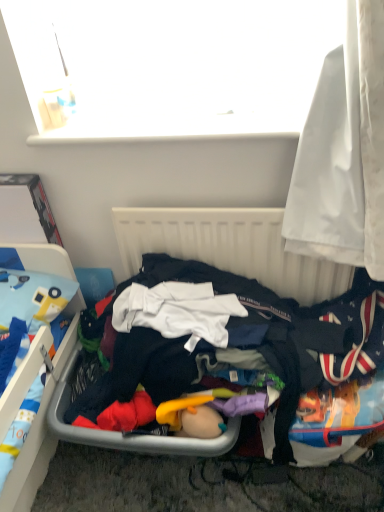
Question: Does white fabric curtain at right turn towards white plastic radiator at center?

Choices:
 (A) no
 (B) yes

Answer: (A)

Question: From a real-world perspective, does white fabric curtain at right stand above white plastic radiator at center?

Choices:
 (A) yes
 (B) no

Answer: (A)

Question: Can you confirm if white fabric curtain at right is thinner than white plastic radiator at center?

Choices:
 (A) yes
 (B) no

Answer: (B)

Question: Is white fabric curtain at right positioned far away from white plastic radiator at center?

Choices:
 (A) no
 (B) yes

Answer: (A)

Question: Does white fabric curtain at right have a lesser height compared to white plastic radiator at center?

Choices:
 (A) no
 (B) yes

Answer: (A)

Question: Is white fabric curtain at right taller than white plastic radiator at center?

Choices:
 (A) yes
 (B) no

Answer: (A)

Question: From a real-world perspective, is white plastic radiator at center physically below white fabric curtain at right?

Choices:
 (A) no
 (B) yes

Answer: (B)

Question: Can you confirm if white plastic radiator at center is taller than white fabric curtain at right?

Choices:
 (A) no
 (B) yes

Answer: (A)

Question: Is white plastic radiator at center not close to white fabric curtain at right?

Choices:
 (A) yes
 (B) no

Answer: (B)

Question: Does white plastic radiator at center touch white fabric curtain at right?

Choices:
 (A) no
 (B) yes

Answer: (A)

Question: Can you confirm if white plastic radiator at center is thinner than white fabric curtain at right?

Choices:
 (A) no
 (B) yes

Answer: (B)

Question: Does white plastic radiator at center contain white fabric curtain at right?

Choices:
 (A) yes
 (B) no

Answer: (B)

Question: Does white fabric curtain at right have a larger size compared to dark blue fabric at center?

Choices:
 (A) yes
 (B) no

Answer: (B)